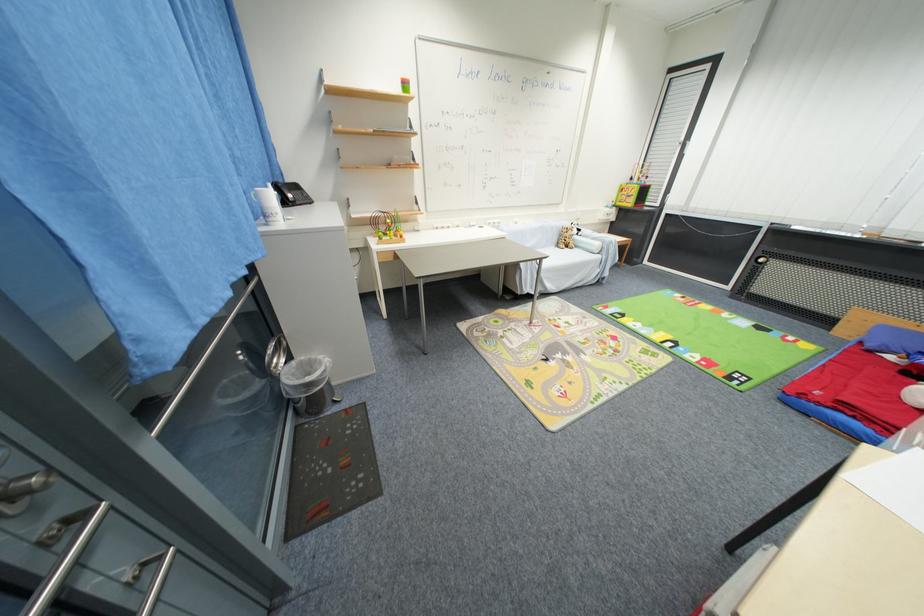
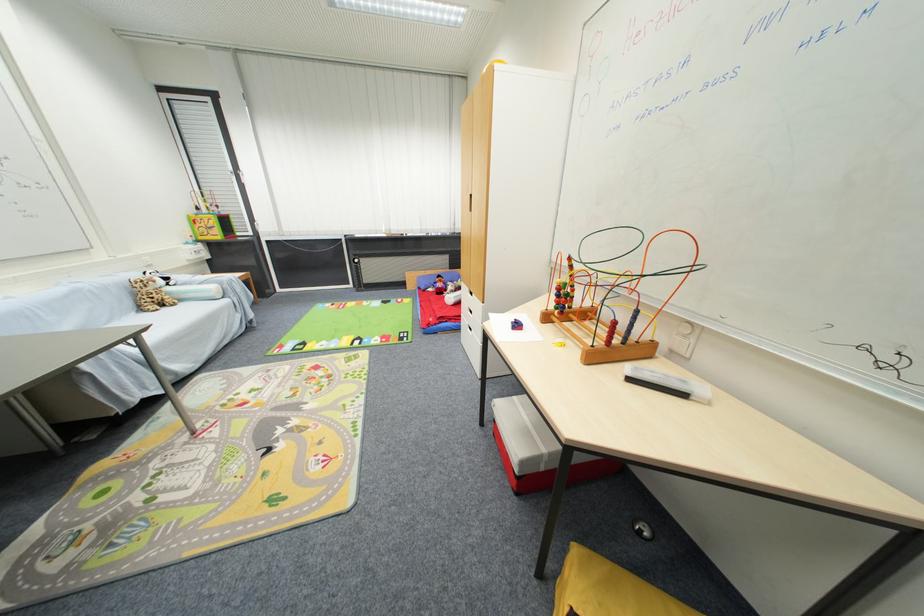
Find the pixel in the second image that matches pixel 563 246 in the first image.

(146, 310)